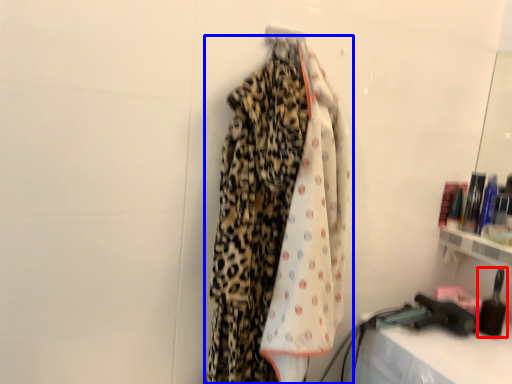
Question: Among these objects, which one is nearest to the camera, toiletry (highlighted by a red box) or curtain (highlighted by a blue box)?

Choices:
 (A) toiletry
 (B) curtain

Answer: (B)